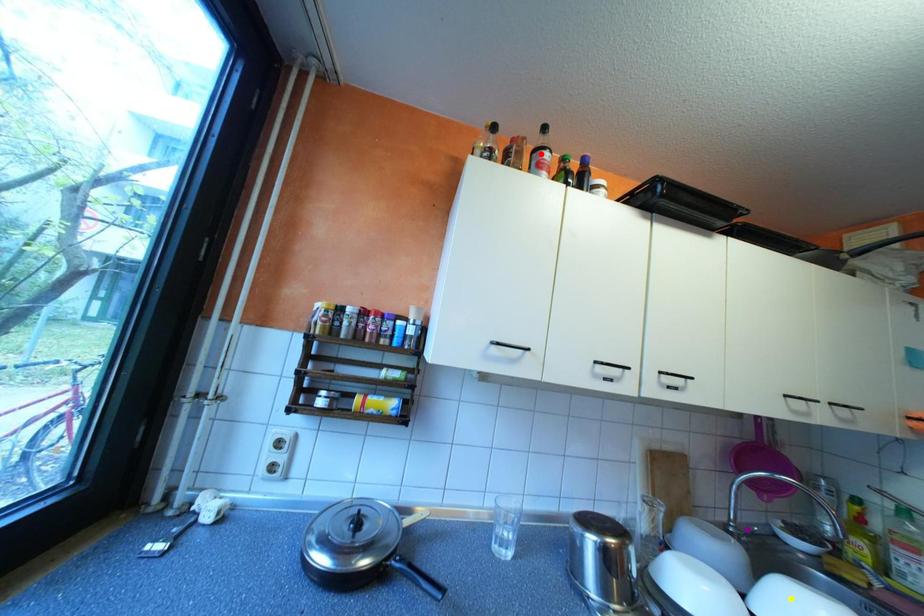
Order these from nearest to farthest:
red point
purple point
yellow point

purple point → red point → yellow point